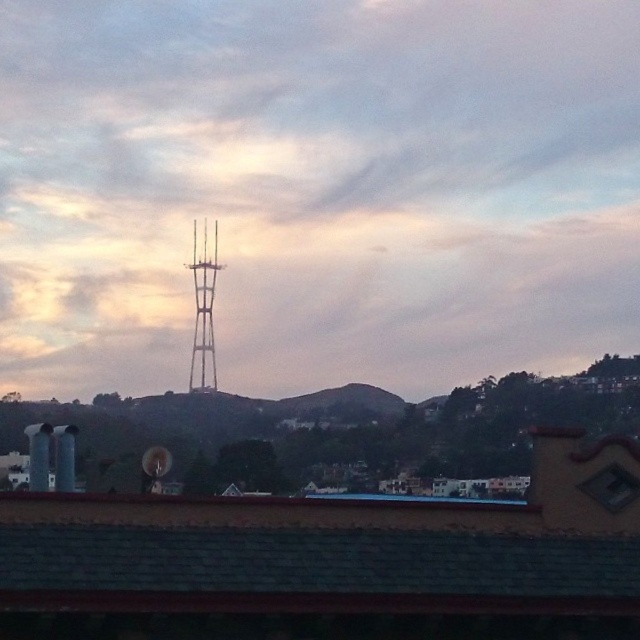
Is white fluffy cloud at upper center to the left of green grassy hill at center from the viewer's perspective?

Yes, white fluffy cloud at upper center is to the left of green grassy hill at center.

Based on the photo, who is shorter, white fluffy cloud at upper center or green grassy hill at center?

Standing shorter between the two is green grassy hill at center.

Where is `white fluffy cloud at upper center`? The image size is (640, 640). white fluffy cloud at upper center is located at coordinates (316, 189).

Does white fluffy cloud at upper center have a lesser height compared to metallic tower at center?

Incorrect, white fluffy cloud at upper center's height does not fall short of metallic tower at center's.

Which is more to the left, white fluffy cloud at upper center or metallic tower at center?

Positioned to the left is metallic tower at center.

I want to click on white fluffy cloud at upper center, so click(316, 189).

Locate an element on the screen. The width and height of the screenshot is (640, 640). green grassy hill at center is located at coordinates (339, 404).

Between green grassy hill at center and metallic tower at center, which one has more height?

metallic tower at center is taller.

Between point (280, 401) and point (198, 300), which one is positioned in front?

Point (280, 401)

In order to click on green grassy hill at center in this screenshot , I will do `click(339, 404)`.